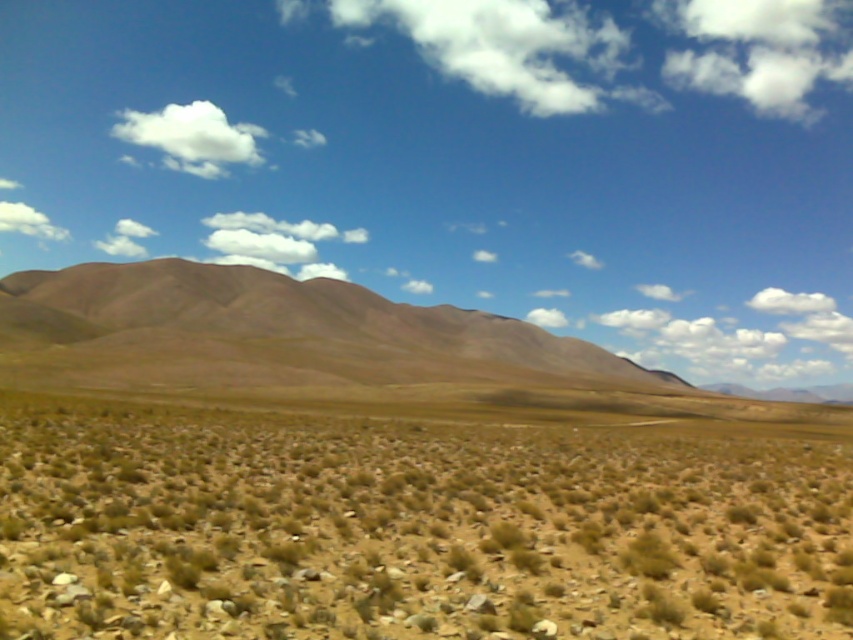
Question: From the image, what is the correct spatial relationship of brown dry grass at center in relation to white fluffy cloud at upper left?

Choices:
 (A) below
 (B) above

Answer: (A)

Question: Which object is farther from the camera taking this photo?

Choices:
 (A) brown/dry soil at center
 (B) white fluffy cloud at upper left
 (C) brown dry grass at center
 (D) white fluffy cloud at upper center

Answer: (D)

Question: Observing the image, what is the correct spatial positioning of white fluffy cloud at upper center in reference to white fluffy cloud at upper left?

Choices:
 (A) right
 (B) left

Answer: (A)

Question: Which point appears closest to the camera in this image?

Choices:
 (A) (59, 230)
 (B) (340, 301)

Answer: (B)

Question: Does brown dry grass at center appear on the left side of brown/dry soil at center?

Choices:
 (A) no
 (B) yes

Answer: (A)

Question: Which point appears farthest from the camera in this image?

Choices:
 (A) (195, 131)
 (B) (51, 618)
 (C) (39, 220)
 (D) (268, 328)

Answer: (C)